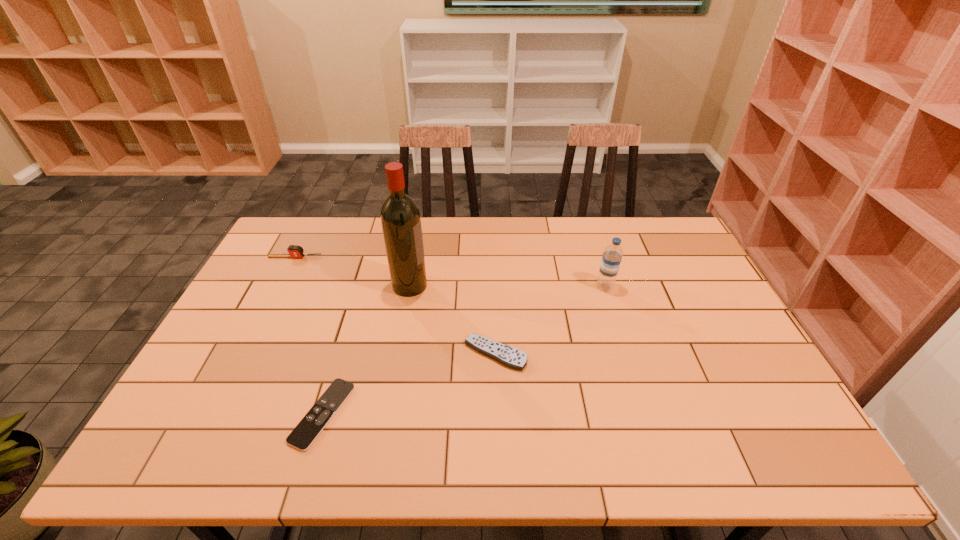
I want to click on object at the far left corner, so (x=295, y=251).

Identify the location of vacant region at the far edge of the desktop. pos(344,226).

Identify the location of vacant space at the near edge. The image size is (960, 540). (703, 439).

In the image, there is a desktop. Where is `free space at the left edge`? Image resolution: width=960 pixels, height=540 pixels. free space at the left edge is located at coordinates (279, 265).

The image size is (960, 540). What are the coordinates of `vacant space at the near left corner of the desktop` in the screenshot? It's located at (154, 453).

At what (x,y) coordinates should I click in order to perform the action: click on vacant space at the far right corner. Please return your answer as a coordinate pair (x, y). Looking at the image, I should click on (685, 255).

Locate an element on the screen. vacant region at the near right corner of the desktop is located at coordinates (745, 442).

Identify the location of free spot between the fourth tallest object and the third object from right to left. Image resolution: width=960 pixels, height=540 pixels. (452, 320).

Where is `empty space between the second object from right to left and the third object from right to left`? The width and height of the screenshot is (960, 540). empty space between the second object from right to left and the third object from right to left is located at coordinates (452, 320).

Locate an element on the screen. vacant space that is in between the rightmost object and the nearer remote control is located at coordinates (464, 350).